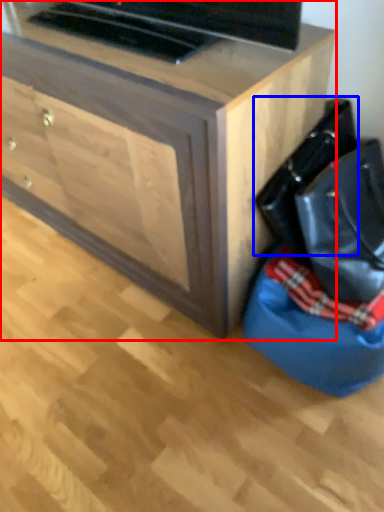
Question: Which object is further to the camera taking this photo, chest of drawers (highlighted by a red box) or messenger bag (highlighted by a blue box)?

Choices:
 (A) chest of drawers
 (B) messenger bag

Answer: (B)